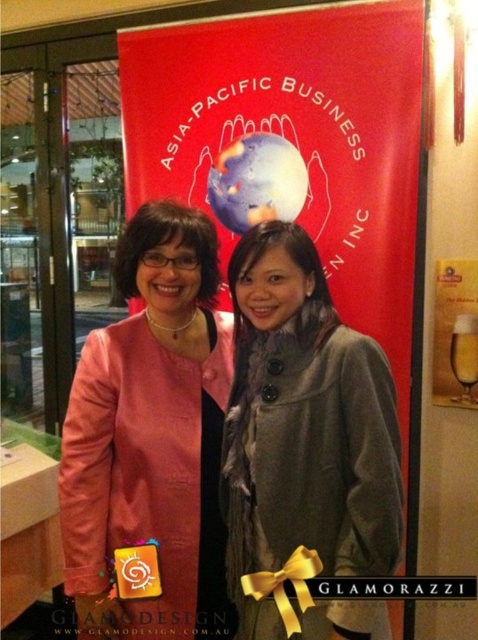
Question: From the image, what is the correct spatial relationship of red fabric banner at center in relation to pink leather jacket at center?

Choices:
 (A) above
 (B) below

Answer: (A)

Question: Which point is farther from the camera taking this photo?

Choices:
 (A) (404, 422)
 (B) (174, 310)
 (C) (273, 234)

Answer: (A)

Question: Which object is positioned closest to the pink leather jacket at center?

Choices:
 (A) red fabric banner at center
 (B) gray wool coat at center

Answer: (B)

Question: Among these points, which one is nearest to the camera?

Choices:
 (A) (176, 458)
 (B) (402, 292)

Answer: (A)

Question: Considering the relative positions of pink leather jacket at center and gray wool coat at center in the image provided, where is pink leather jacket at center located with respect to gray wool coat at center?

Choices:
 (A) above
 (B) below

Answer: (A)

Question: Does red fabric banner at center have a greater width compared to gray wool coat at center?

Choices:
 (A) yes
 (B) no

Answer: (A)